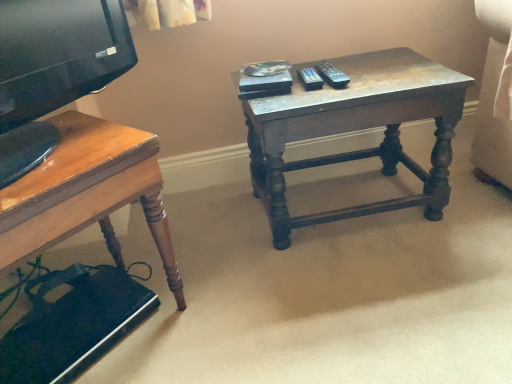
In order to click on vacant point above distressed wood table at center (from a real-world perspective) in this screenshot , I will do `click(356, 72)`.